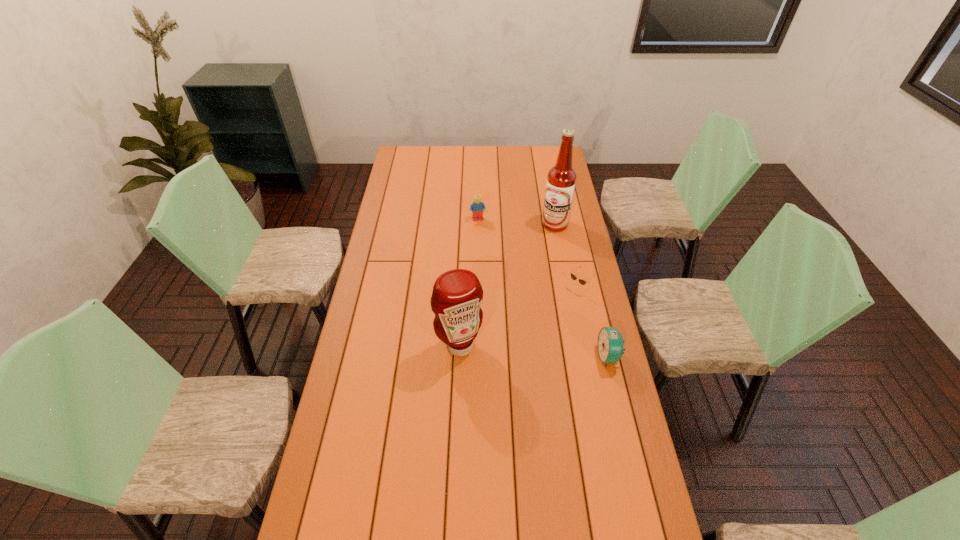
This screenshot has height=540, width=960. Find the location of `free spot on the desktop that is between the condiment and the alarm clock and is positioned on the label side of the tallest object`. free spot on the desktop that is between the condiment and the alarm clock and is positioned on the label side of the tallest object is located at coordinates (545, 352).

At what (x,y) coordinates should I click in order to perform the action: click on vacant space on the desktop that is between the condiment and the alarm clock and is positioned in front of the lenses of the third farthest object. Please return your answer as a coordinate pair (x, y). Image resolution: width=960 pixels, height=540 pixels. Looking at the image, I should click on (514, 349).

At what (x,y) coordinates should I click in order to perform the action: click on vacant space on the desktop that is between the condiment and the alarm clock and is positioned on the face of the Lego. Please return your answer as a coordinate pair (x, y). This screenshot has height=540, width=960. Looking at the image, I should click on (520, 350).